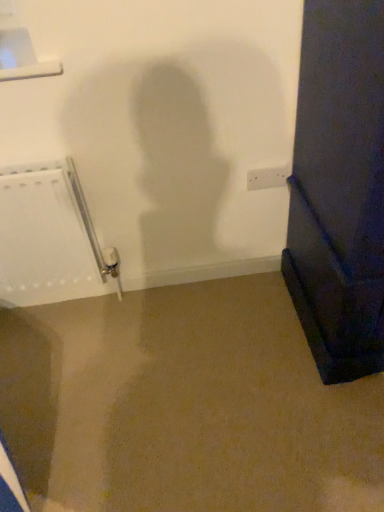
Question: Can you see white matte radiator at left touching white plastic electric outlet at center?

Choices:
 (A) no
 (B) yes

Answer: (A)

Question: From the image's perspective, does white matte radiator at left appear higher than white plastic electric outlet at center?

Choices:
 (A) yes
 (B) no

Answer: (B)

Question: Considering the relative sizes of white matte radiator at left and white plastic electric outlet at center in the image provided, is white matte radiator at left wider than white plastic electric outlet at center?

Choices:
 (A) yes
 (B) no

Answer: (A)

Question: Is white matte radiator at left oriented away from white plastic electric outlet at center?

Choices:
 (A) no
 (B) yes

Answer: (A)

Question: Is white matte radiator at left not within white plastic electric outlet at center?

Choices:
 (A) yes
 (B) no

Answer: (A)

Question: Considering the relative sizes of white matte radiator at left and white plastic electric outlet at center in the image provided, is white matte radiator at left thinner than white plastic electric outlet at center?

Choices:
 (A) no
 (B) yes

Answer: (A)

Question: From the image's perspective, does white plastic electric outlet at center appear higher than white matte radiator at left?

Choices:
 (A) yes
 (B) no

Answer: (A)

Question: From a real-world perspective, is white plastic electric outlet at center on white matte radiator at left?

Choices:
 (A) yes
 (B) no

Answer: (A)

Question: Is white matte radiator at left a part of white plastic electric outlet at center?

Choices:
 (A) no
 (B) yes

Answer: (A)

Question: Is white plastic electric outlet at center to the right of white matte radiator at left from the viewer's perspective?

Choices:
 (A) yes
 (B) no

Answer: (A)

Question: Is white plastic electric outlet at center positioned far away from white matte radiator at left?

Choices:
 (A) no
 (B) yes

Answer: (A)

Question: Can you confirm if white plastic electric outlet at center is bigger than white matte radiator at left?

Choices:
 (A) no
 (B) yes

Answer: (A)

Question: Visually, is white matte radiator at left positioned to the left or to the right of white plastic electric outlet at center?

Choices:
 (A) right
 (B) left

Answer: (B)